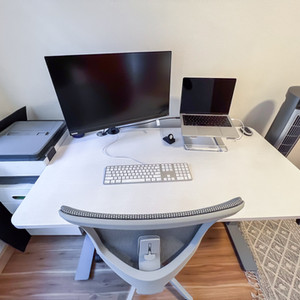
Locate an element on the screen. This screenshot has height=300, width=300. fringe of rug is located at coordinates (254, 295).